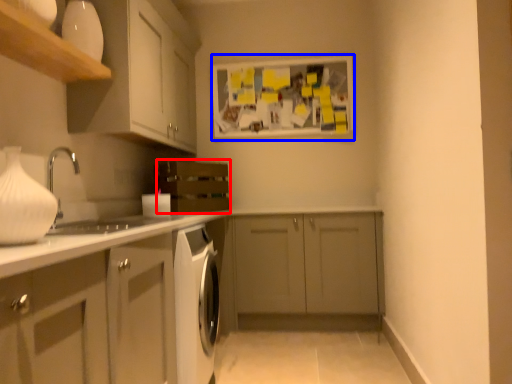
Question: Which point is closer to the camera, oven (highlighted by a red box) or bulletin board (highlighted by a blue box)?

Choices:
 (A) oven
 (B) bulletin board

Answer: (A)